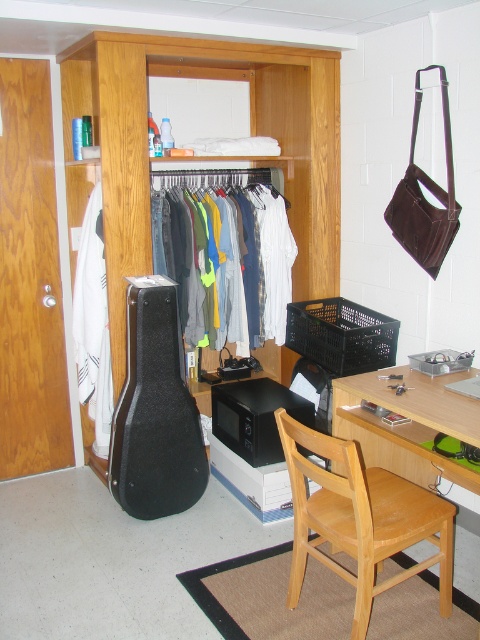
Looking at this image, you are moving into this room and need to access your denim jeans at center. However, there is a black hard case guitar at lower left blocking the path. Can you move the guitar to reach the jeans?

The black hard case guitar at lower left is behind the denim jeans at center, so it is not blocking the path. You can access the denim jeans at center without moving the guitar.

You are standing in the room and want to place a new item between the two points marked as point (253, 128) and point (201, 467). Which point should you stand closer to in order to place the item in front of you?

You should stand closer to point (253, 128) because it is closer to you than point (201, 467), so placing the item there would be in front of you.